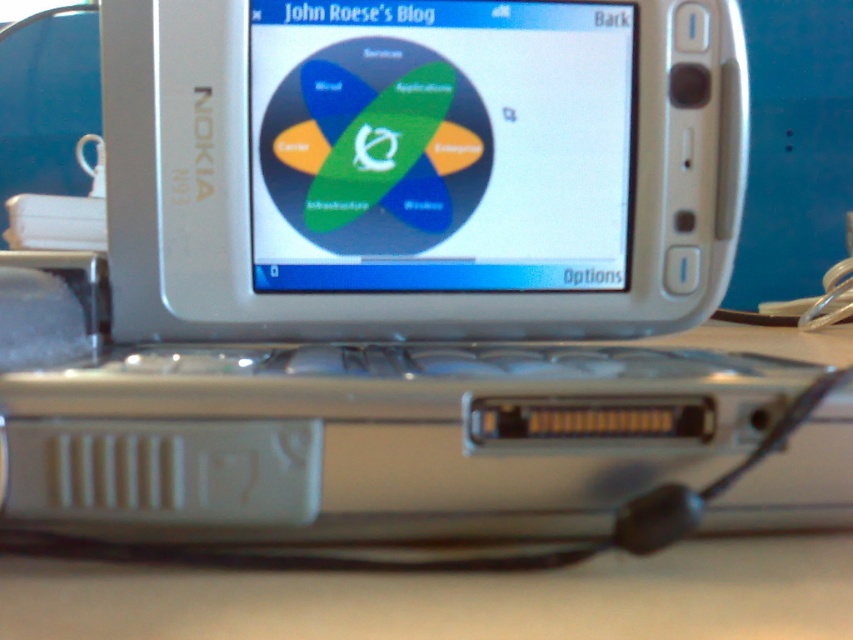
You are a photographer trying to capture a clear shot of the matte plastic screen at center and the white plastic table at lower center. Based on their sizes, which object should you focus on first to ensure it appears sharp in the photo?

The matte plastic screen at center is much taller than the white plastic table at lower center, so you should focus on the matte plastic screen at center first to ensure it appears sharp in the photo.

You are holding a magnifying glass and looking at the matte plastic screen at center and the white plastic table at lower center. Which object is closer to your eyes?

The matte plastic screen at center is closer to your eyes because it is further to the viewer than the white plastic table at lower center.

You are trying to place a phone case that is 10 cm wide on the white plastic table at lower center. The matte plastic screen at center is currently occupying some space. Can the phone case fit on the table without overlapping the screen?

The matte plastic screen at center is less wide than the white plastic table at lower center. Since the phone case is 10 cm wide, it can fit on the table as long as it is placed in an area not occupied by the screen.